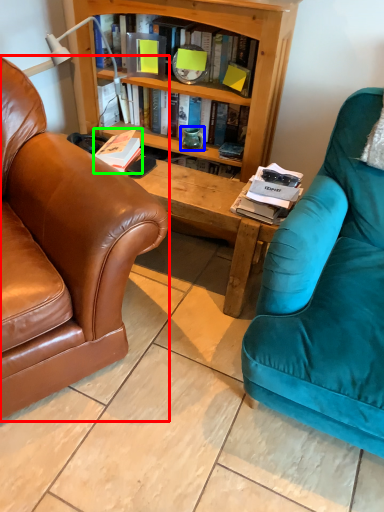
Question: Considering the real-world distances, which object is farthest from chair (highlighted by a red box)? teal (highlighted by a blue box) or book (highlighted by a green box)?

Choices:
 (A) teal
 (B) book

Answer: (A)